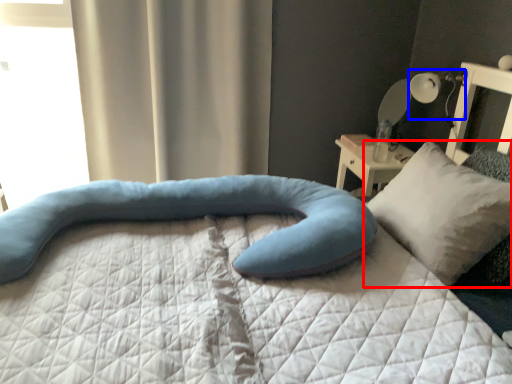
Question: Which object is further to the camera taking this photo, pillow (highlighted by a red box) or table lamp (highlighted by a blue box)?

Choices:
 (A) pillow
 (B) table lamp

Answer: (B)